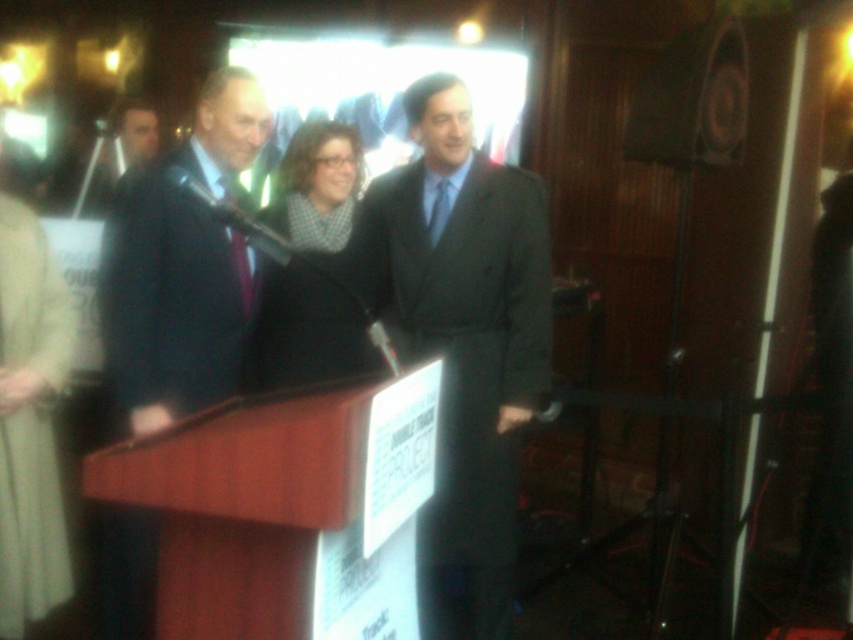
Is dark gray suit at center in front of black wool scarf at center?

No, dark gray suit at center is further to the viewer.

Where is `dark gray suit at center`? The width and height of the screenshot is (853, 640). dark gray suit at center is located at coordinates (463, 339).

Does matte black suit at center have a larger size compared to black wool scarf at center?

Yes, matte black suit at center is bigger than black wool scarf at center.

Between matte black suit at center and black wool scarf at center, which one is positioned lower?

matte black suit at center is lower down.

Between point (137, 433) and point (258, 384), which one is positioned behind?

The point (258, 384) is behind.

The height and width of the screenshot is (640, 853). I want to click on matte black suit at center, so click(x=183, y=266).

In the scene shown: How much distance is there between black wool scarf at center and matte black speaker at upper right?

They are 1.16 meters apart.

Can you confirm if black wool scarf at center is thinner than matte black speaker at upper right?

Correct, black wool scarf at center's width is less than matte black speaker at upper right's.

Is point (268, 323) behind point (735, 136)?

That is False.

Where is `black wool scarf at center`? Image resolution: width=853 pixels, height=640 pixels. black wool scarf at center is located at coordinates 306,328.